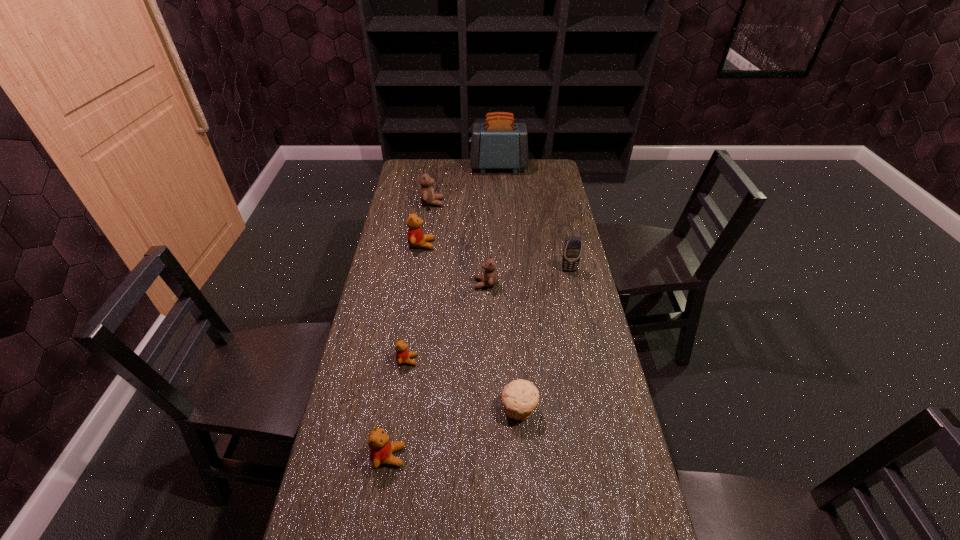
Where is `the third nearest teddy bear`? the third nearest teddy bear is located at coordinates (489, 278).

The height and width of the screenshot is (540, 960). In order to click on the right brown teddy bear in this screenshot , I will do `click(489, 278)`.

Locate an element on the screen. This screenshot has height=540, width=960. the seventh farthest object is located at coordinates (520, 397).

What are the coordinates of `beige muffin` in the screenshot? It's located at (520, 397).

I want to click on the second nearest red teddy bear, so click(x=403, y=356).

What are the coordinates of `the fourth farthest teddy bear` in the screenshot? It's located at (403, 356).

Find the location of a particular element. free space located 0.300m on the front-facing side of the toaster is located at coordinates (408, 167).

Locate an element on the screen. The height and width of the screenshot is (540, 960). free spot located 0.160m on the front-facing side of the toaster is located at coordinates (437, 167).

The height and width of the screenshot is (540, 960). Find the location of `free space located 0.260m on the front-facing side of the toaster`. free space located 0.260m on the front-facing side of the toaster is located at coordinates 417,167.

This screenshot has height=540, width=960. Find the location of `vacant area situated 0.210m on the front-facing side of the second farthest object`. vacant area situated 0.210m on the front-facing side of the second farthest object is located at coordinates (492, 203).